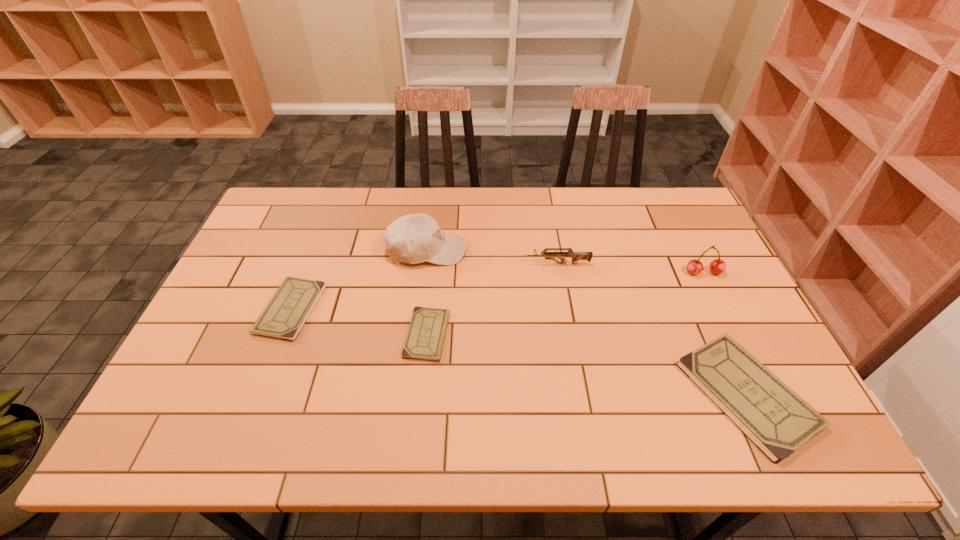
Find the location of `free space that is in between the cherry and the second tallest checkbook`. free space that is in between the cherry and the second tallest checkbook is located at coordinates click(497, 291).

Locate an element on the screen. This screenshot has width=960, height=540. vacant area between the third shortest object and the second shortest object is located at coordinates (518, 352).

Where is `vacant space that is in between the baseball cap and the shortest object`? This screenshot has height=540, width=960. vacant space that is in between the baseball cap and the shortest object is located at coordinates (427, 292).

The width and height of the screenshot is (960, 540). What are the coordinates of `free space that is in between the baseball cap and the leftmost object` in the screenshot? It's located at (359, 280).

You are a GUI agent. You are given a task and a screenshot of the screen. Output one action in this format:
    pyautogui.click(x=<x>, y=<y>)
    Task: Click on the object that stands as the second closest to the third object from right to left
    The height and width of the screenshot is (540, 960).
    Given the screenshot: What is the action you would take?
    pyautogui.click(x=717, y=266)

Locate which object is the fifth closest to the leftmost object. Please provide its 2D coordinates. Your answer should be formatted as a tuple, i.e. [(x, y)], where the tuple contains the x and y coordinates of a point satisfying the conditions above.

[(717, 266)]

Locate which checkbook ranks in proximity to the rightmost checkbook. Please provide its 2D coordinates. Your answer should be formatted as a tuple, i.e. [(x, y)], where the tuple contains the x and y coordinates of a point satisfying the conditions above.

[(427, 329)]

Locate an element on the screen. Image resolution: width=960 pixels, height=540 pixels. checkbook that stands as the third closest to the cherry is located at coordinates (286, 313).

The width and height of the screenshot is (960, 540). I want to click on vacant space that satisfies the following two spatial constraints: 1. on the front-facing side of the baseball cap; 2. on the right side of the tallest checkbook, so click(409, 394).

Find the location of a particular element. free space that satisfies the following two spatial constraints: 1. aimed along the barrel of the third object from right to left; 2. on the left side of the rightmost checkbook is located at coordinates (580, 394).